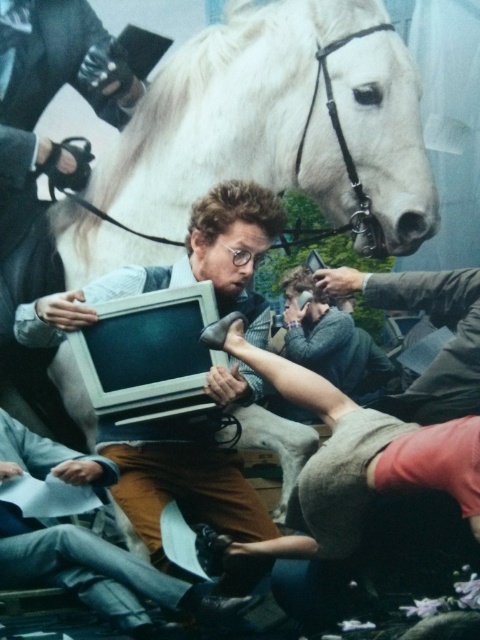
You are a photographer trying to capture the chaotic scene. You have two monitors available to view the image details. The matte plastic monitor at center and the matte gray monitor at center. Which monitor should you choose to view more details of the scene?

The matte plastic monitor at center has a larger size compared to the matte gray monitor at center, so you should choose the matte plastic monitor at center to view more details of the scene.

You are a photographer standing 10 feet away from the scene. You want to take a closeup photo of the smooth gray shirt at center without including the matte black monitor at center in the frame. Is this possible given their distance apart?

The matte black monitor at center is 6.48 feet from the smooth gray shirt at center. Since you are 10 feet away from the scene, the distance between the two objects is less than your distance, so it is possible to take a closeup photo of the smooth gray shirt at center without including the matte black monitor at center by adjusting the camera angle or zoom.